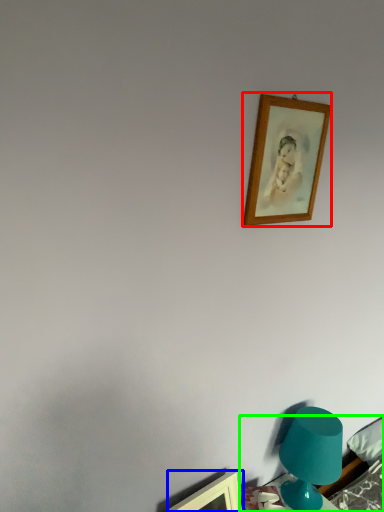
Question: Based on their relative distances, which object is nearer to picture frame (highlighted by a red box)? Choose from picture frame (highlighted by a blue box) and furniture (highlighted by a green box).

Choices:
 (A) picture frame
 (B) furniture

Answer: (B)